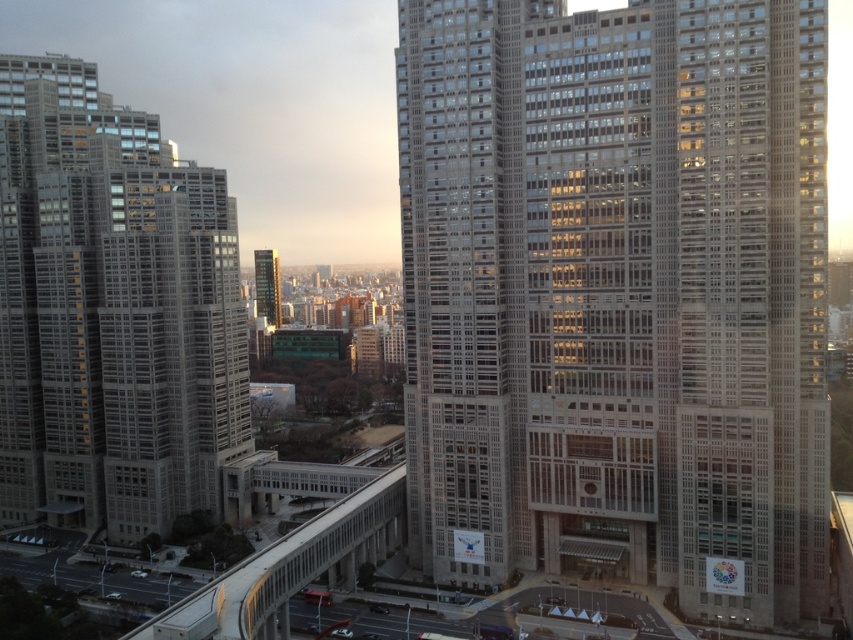
Question: Which object appears closest to the camera in this image?

Choices:
 (A) gray concrete skyscraper at left
 (B) green glass tower at upper left
 (C) beige concrete building at center

Answer: (C)

Question: Is beige concrete building at center wider than green glass tower at upper left?

Choices:
 (A) yes
 (B) no

Answer: (A)

Question: Can you confirm if beige concrete building at center is positioned below green glass tower at upper left?

Choices:
 (A) no
 (B) yes

Answer: (B)

Question: Which point is closer to the camera taking this photo?

Choices:
 (A) (113, 397)
 (B) (271, 282)

Answer: (A)

Question: Which point is closer to the camera?

Choices:
 (A) green glass tower at upper left
 (B) beige concrete building at center

Answer: (B)

Question: Considering the relative positions of beige concrete building at center and gray concrete skyscraper at left in the image provided, where is beige concrete building at center located with respect to gray concrete skyscraper at left?

Choices:
 (A) left
 (B) right

Answer: (B)